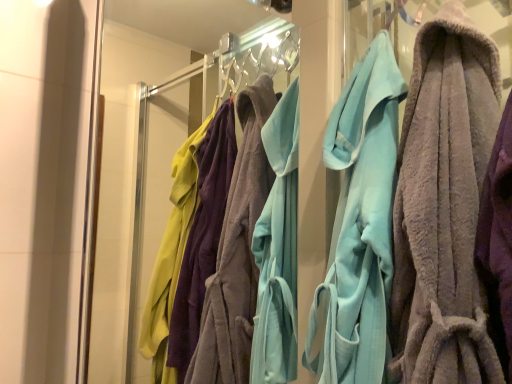
Question: From the image's perspective, is light blue plush robe at center, acting as the 2th towel starting from the front, positioned above or below soft gray towel at center, marked as the second towel in a back-to-front arrangement?

Choices:
 (A) below
 (B) above

Answer: (A)

Question: Based on their sizes in the image, would you say light blue plush robe at center, acting as the 2th towel starting from the front, is bigger or smaller than soft gray towel at center, marked as the 1th towel in a front-to-back arrangement?

Choices:
 (A) big
 (B) small

Answer: (B)

Question: Considering the real-world distances, which object is farthest from the transparent glass door at center?

Choices:
 (A) light blue plush robe at center, acting as the 2th towel starting from the front
 (B) soft gray towel at center, marked as the 1th towel in a front-to-back arrangement

Answer: (B)

Question: Estimate the real-world distances between objects in this image. Which object is farther from the transparent glass door at center?

Choices:
 (A) soft gray towel at center, marked as the second towel in a back-to-front arrangement
 (B) light blue plush robe at center, arranged as the first towel when viewed from the back

Answer: (A)